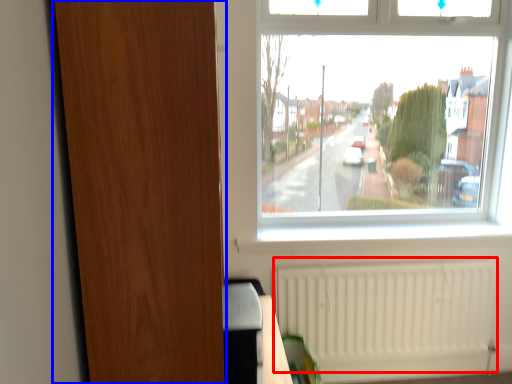
Question: Among these objects, which one is nearest to the camera, radiator (highlighted by a red box) or screen door (highlighted by a blue box)?

Choices:
 (A) radiator
 (B) screen door

Answer: (B)